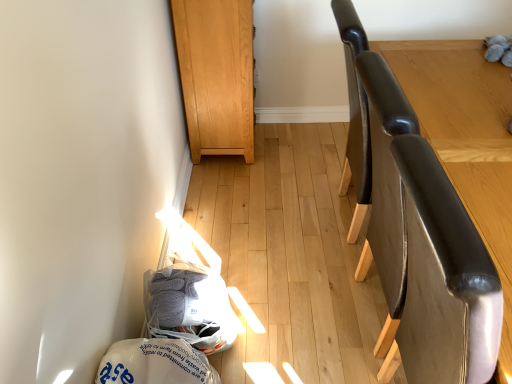
Where is `free spot to the right of light brown wood cabinet at upper center`? The height and width of the screenshot is (384, 512). free spot to the right of light brown wood cabinet at upper center is located at coordinates (292, 151).